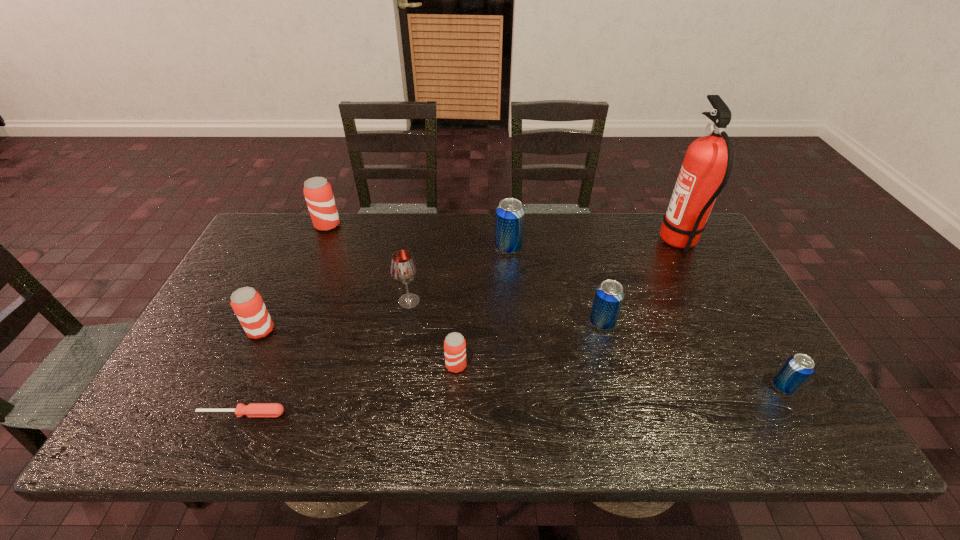
Find the location of `the tallest object`. the tallest object is located at coordinates (706, 168).

Where is `red fire extinguisher`? This screenshot has height=540, width=960. red fire extinguisher is located at coordinates (706, 168).

Image resolution: width=960 pixels, height=540 pixels. I want to click on the farthest orange beer can, so click(x=318, y=193).

Where is `the farthest beer can`? The width and height of the screenshot is (960, 540). the farthest beer can is located at coordinates (318, 193).

You are a GUI agent. You are given a task and a screenshot of the screen. Output one action in this format:
    pyautogui.click(x=<x>, y=<y>)
    Task: Click on the leftmost blue beer can
    The width and height of the screenshot is (960, 540).
    Given the screenshot: What is the action you would take?
    pyautogui.click(x=509, y=225)

Image resolution: width=960 pixels, height=540 pixels. What are the coordinates of `the fourth object from right to left` in the screenshot? It's located at (509, 225).

You are a GUI agent. You are given a task and a screenshot of the screen. Output one action in this format:
    pyautogui.click(x=<x>, y=<y>)
    Task: Click on the wineglass
    The width and height of the screenshot is (960, 540).
    Given the screenshot: What is the action you would take?
    pyautogui.click(x=403, y=269)

I want to click on the fourth farthest object, so click(x=403, y=269).

Where is `the second nearest orange beer can`? Image resolution: width=960 pixels, height=540 pixels. the second nearest orange beer can is located at coordinates (246, 302).

Identify the location of the third object from right to left. This screenshot has width=960, height=540. (609, 295).